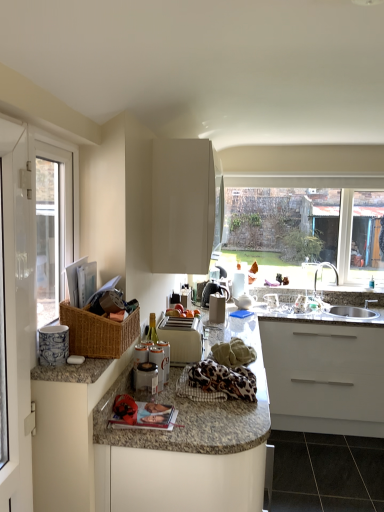
Where is `empty space that is ontop of white glossy screen door at left (from a real-world perspective)`? The width and height of the screenshot is (384, 512). empty space that is ontop of white glossy screen door at left (from a real-world perspective) is located at coordinates (25, 112).